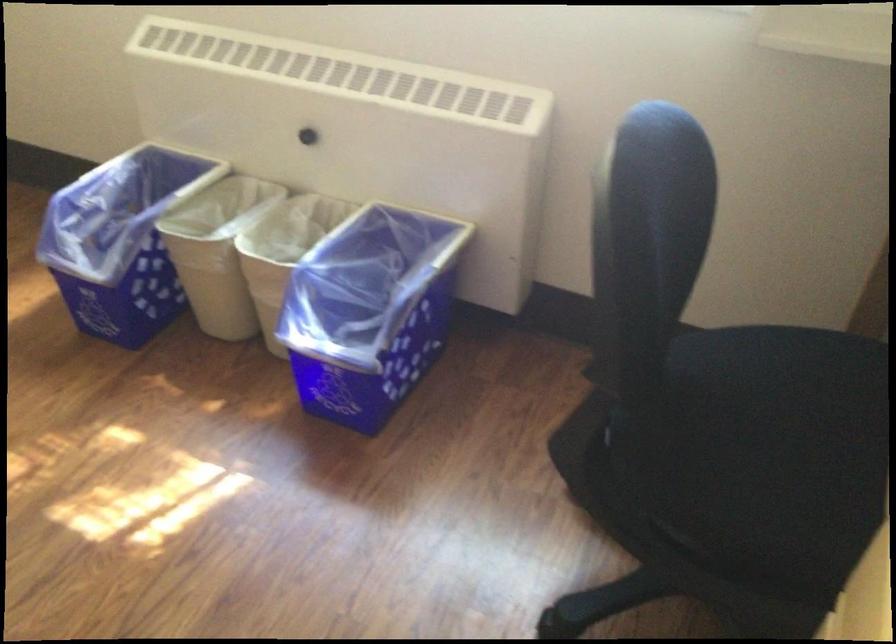
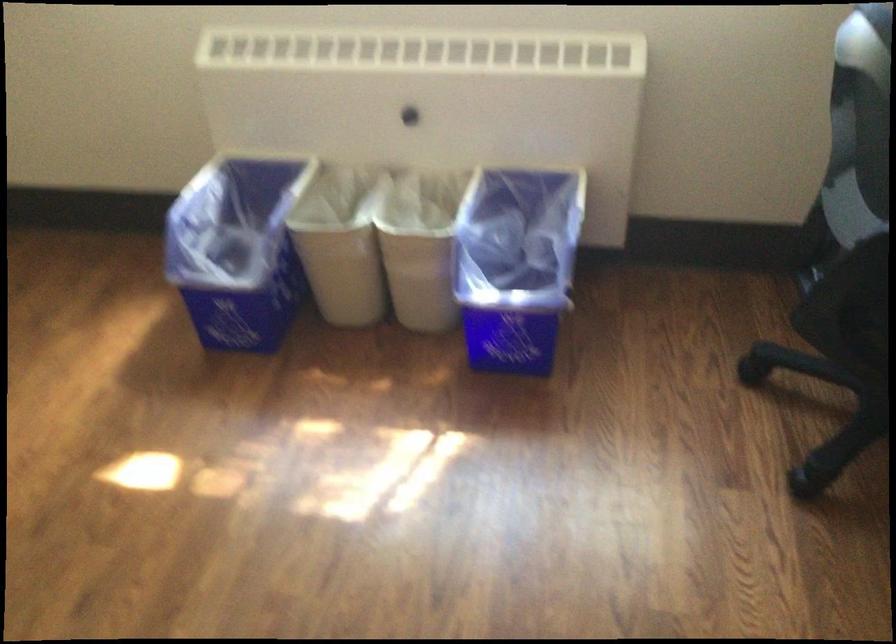
Locate, in the second image, the point that corresponds to point 380,310 in the first image.

(515, 265)